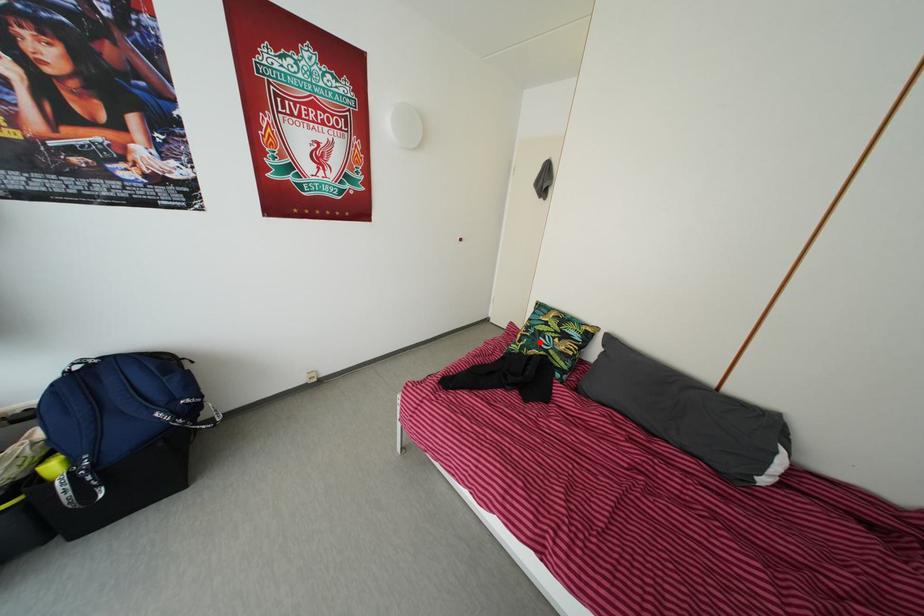
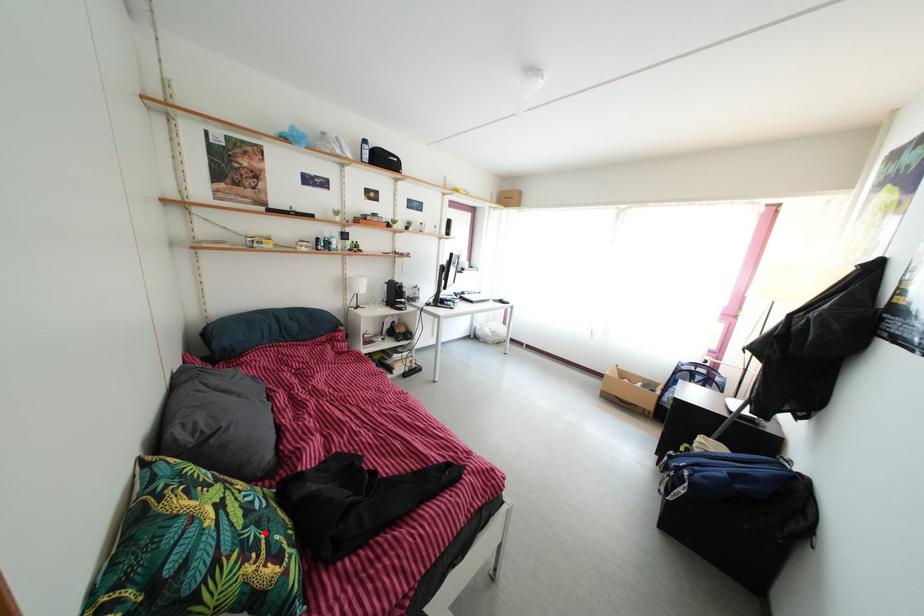
I am providing you with two images of the same scene from different viewpoints. A red point is marked on the first image and another point is marked on the second image. Is the marked point in image1 the same physical position as the marked point in image2?

Yes